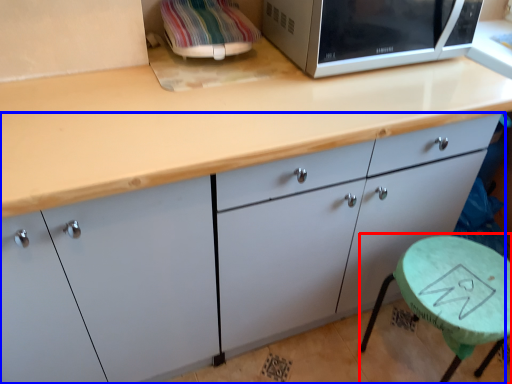
Question: Among these objects, which one is farthest to the camera, round table (highlighted by a red box) or cabinetry (highlighted by a blue box)?

Choices:
 (A) round table
 (B) cabinetry

Answer: (A)